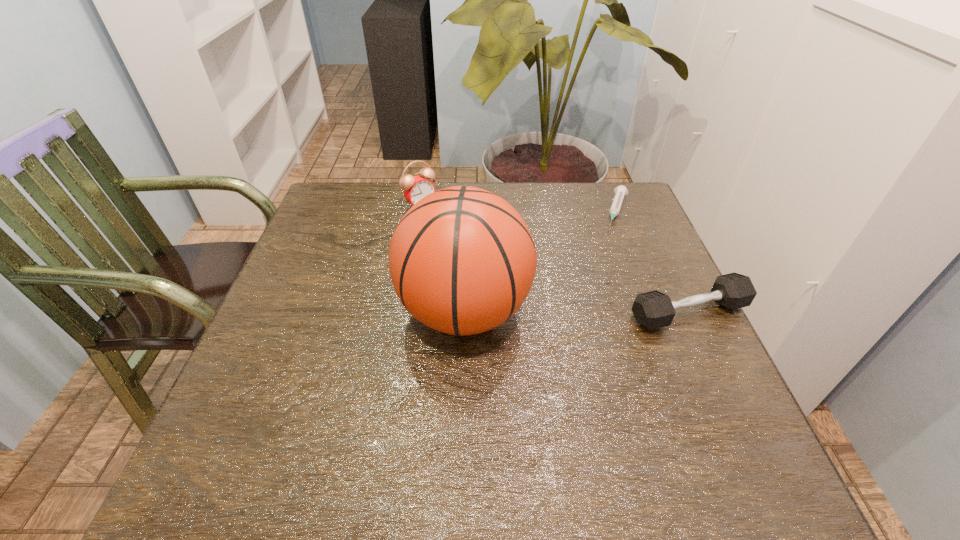
Locate an element on the screen. free space on the desktop that is between the tallest object and the dumbbell and is positioned at the needle end of the shortest object is located at coordinates (585, 312).

You are a GUI agent. You are given a task and a screenshot of the screen. Output one action in this format:
    pyautogui.click(x=<x>, y=<y>)
    Task: Click on the free spot on the desktop that is between the tallest object and the second shortest object and is positioned on the clock face of the third shortest object
    
    Given the screenshot: What is the action you would take?
    pyautogui.click(x=546, y=312)